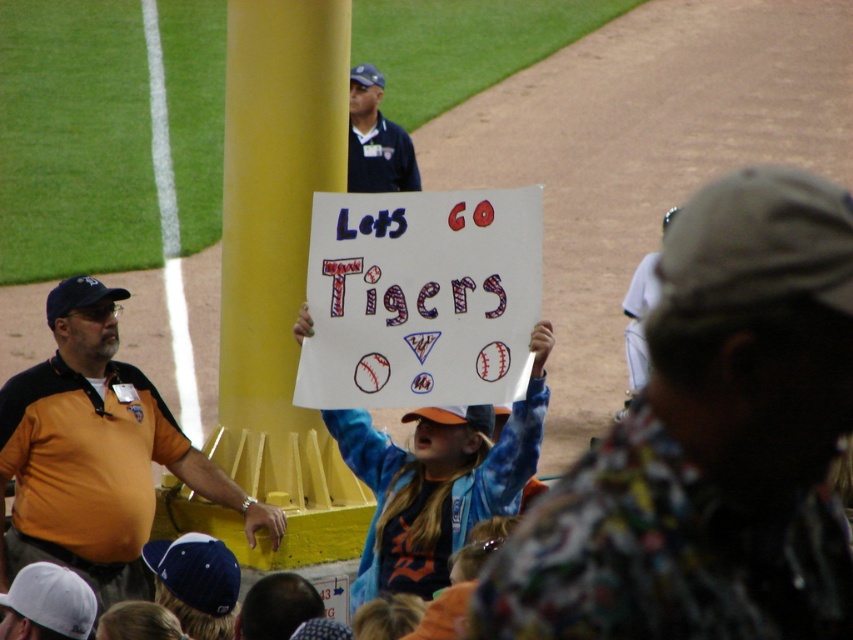
Question: Considering the real-world distances, which object is closest to the yellow painted pole at center?

Choices:
 (A) orange jersey at left
 (B) blue uniform at upper center

Answer: (A)

Question: Can you confirm if yellow painted pole at center is positioned to the right of orange jersey at left?

Choices:
 (A) no
 (B) yes

Answer: (B)

Question: Does orange jersey at left appear on the left side of blue uniform at upper center?

Choices:
 (A) yes
 (B) no

Answer: (A)

Question: Which is farther from the blue uniform at upper center?

Choices:
 (A) yellow painted pole at center
 (B) orange jersey at left
 (C) flannel shirt at center

Answer: (B)

Question: Is yellow painted pole at center further to the viewer compared to orange jersey at left?

Choices:
 (A) yes
 (B) no

Answer: (A)

Question: Among these objects, which one is nearest to the camera?

Choices:
 (A) orange jersey at left
 (B) yellow painted pole at center
 (C) blue uniform at upper center

Answer: (A)